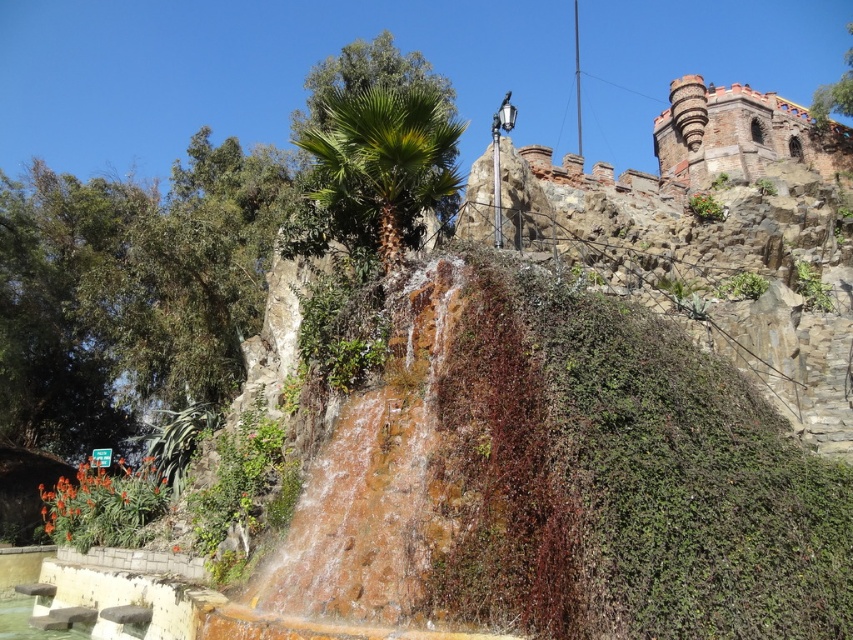
Which is more to the left, green leafy palm at center or clear water at bottom left?

clear water at bottom left is more to the left.

Does green leafy palm at center appear on the right side of clear water at bottom left?

Correct, you'll find green leafy palm at center to the right of clear water at bottom left.

Does point (404, 129) come farther from viewer compared to point (15, 620)?

No, it is in front of (15, 620).

Where is `green leafy palm at center`? The image size is (853, 640). green leafy palm at center is located at coordinates (381, 161).